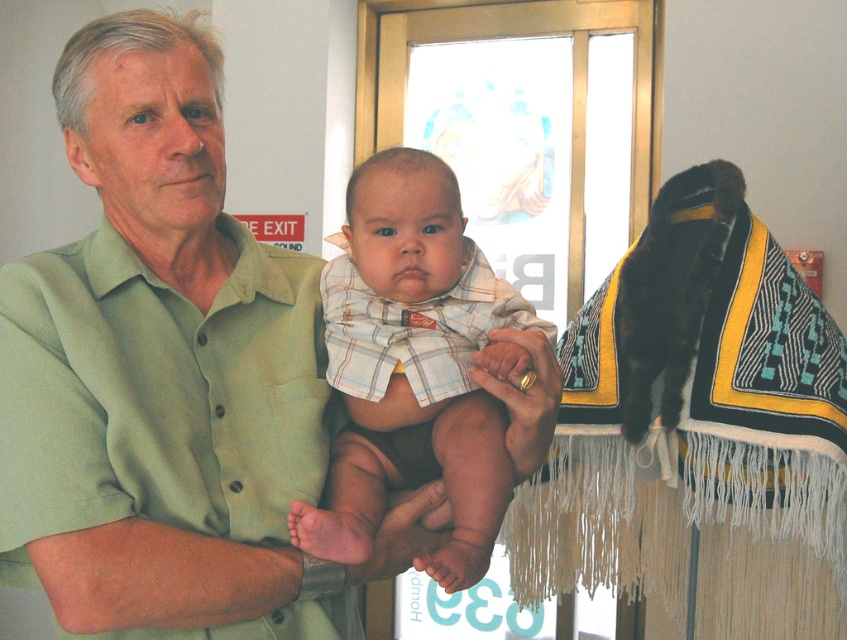
Who is more distant from viewer, (540, 422) or (724, 376)?

The point (724, 376) is behind.

Can you confirm if green cotton shirt at center is taller than black woven blanket at upper right?

In fact, green cotton shirt at center may be shorter than black woven blanket at upper right.

Between point (165, 488) and point (739, 480), which one is positioned behind?

Positioned behind is point (739, 480).

Identify the location of green cotton shirt at center. (161, 378).

Is green cotton shirt at center thinner than plaid fabric baby at center?

In fact, green cotton shirt at center might be wider than plaid fabric baby at center.

Is green cotton shirt at center below plaid fabric baby at center?

No, green cotton shirt at center is not below plaid fabric baby at center.

Is point (25, 353) more distant than point (455, 220)?

No, it is in front of (455, 220).

The width and height of the screenshot is (847, 640). Identify the location of green cotton shirt at center. (161, 378).

Does black woven blanket at upper right appear under plaid fabric baby at center?

Yes.

Based on the photo, between black woven blanket at upper right and plaid fabric baby at center, which one appears on the left side from the viewer's perspective?

Positioned to the left is plaid fabric baby at center.

In order to click on black woven blanket at upper right in this screenshot , I will do `click(696, 428)`.